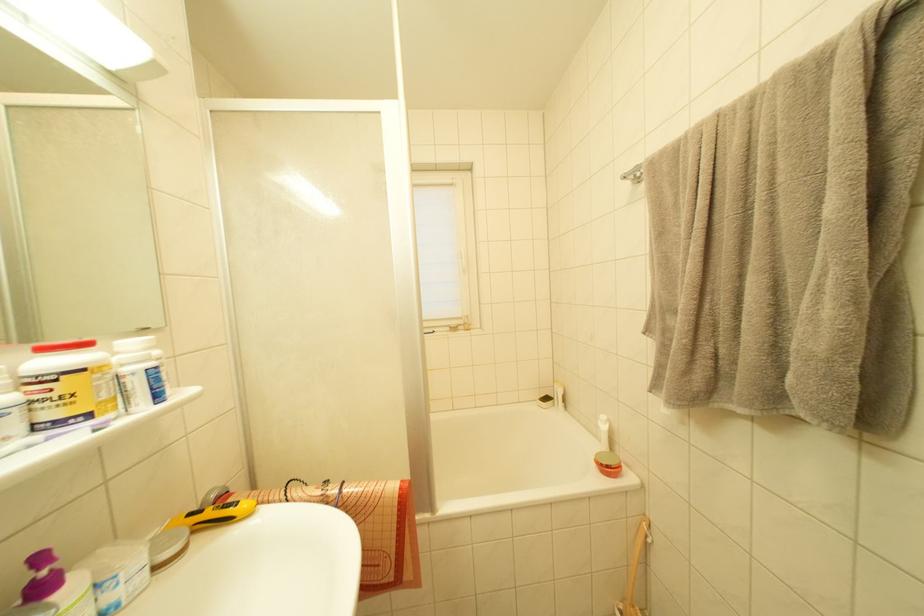
Where would you push the purple pump dispenser? Please return your answer as a coordinate pair (x, y).

(49, 580)